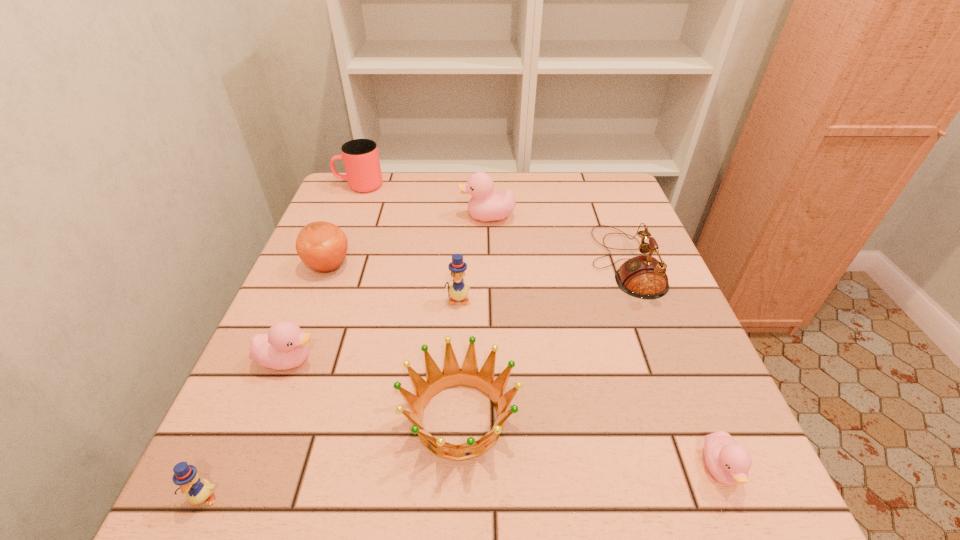
At what (x,y) coordinates should I click in order to perform the action: click on telephone positioned at the right edge. Please return your answer as a coordinate pair (x, y). Looking at the image, I should click on (644, 277).

The image size is (960, 540). Find the location of `duckling at the right edge`. duckling at the right edge is located at coordinates (729, 462).

In order to click on object at the far left corner in this screenshot , I will do `click(361, 160)`.

This screenshot has width=960, height=540. In order to click on object located at the near left corner in this screenshot , I will do `click(186, 476)`.

The height and width of the screenshot is (540, 960). I want to click on object that is at the near right corner, so click(x=729, y=462).

In the image, there is a desktop. At what (x,y) coordinates should I click in order to perform the action: click on vacant space at the far edge. Please return your answer as a coordinate pair (x, y). Looking at the image, I should click on (396, 188).

Where is `vacant space at the near edge of the desktop`? This screenshot has width=960, height=540. vacant space at the near edge of the desktop is located at coordinates (423, 496).

Locate an element on the screen. vacant region at the left edge of the desktop is located at coordinates (278, 371).

At what (x,y) coordinates should I click in order to perform the action: click on blank space at the right edge. Please return your answer as a coordinate pair (x, y). The height and width of the screenshot is (540, 960). Looking at the image, I should click on (627, 383).

Image resolution: width=960 pixels, height=540 pixels. I want to click on vacant point at the far right corner, so click(x=571, y=179).